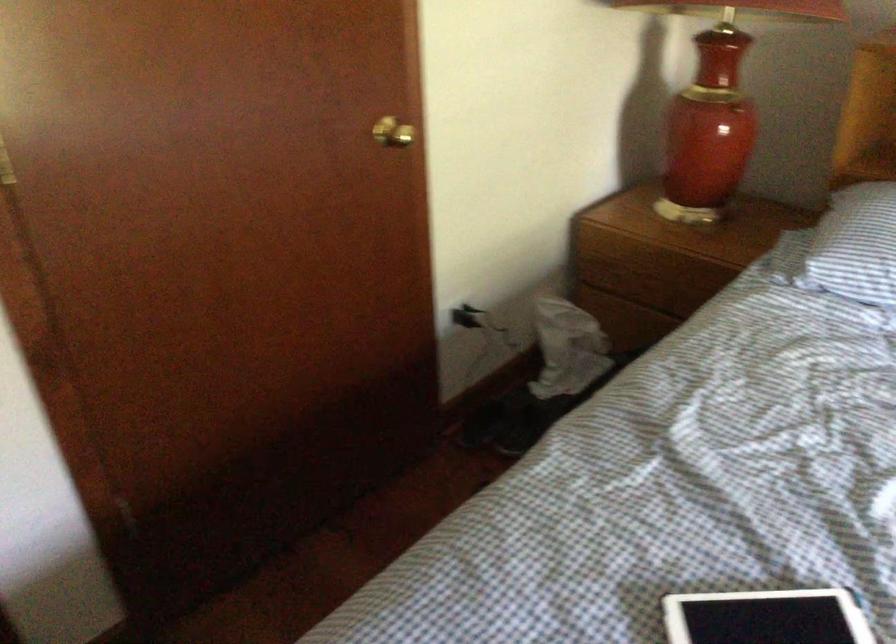
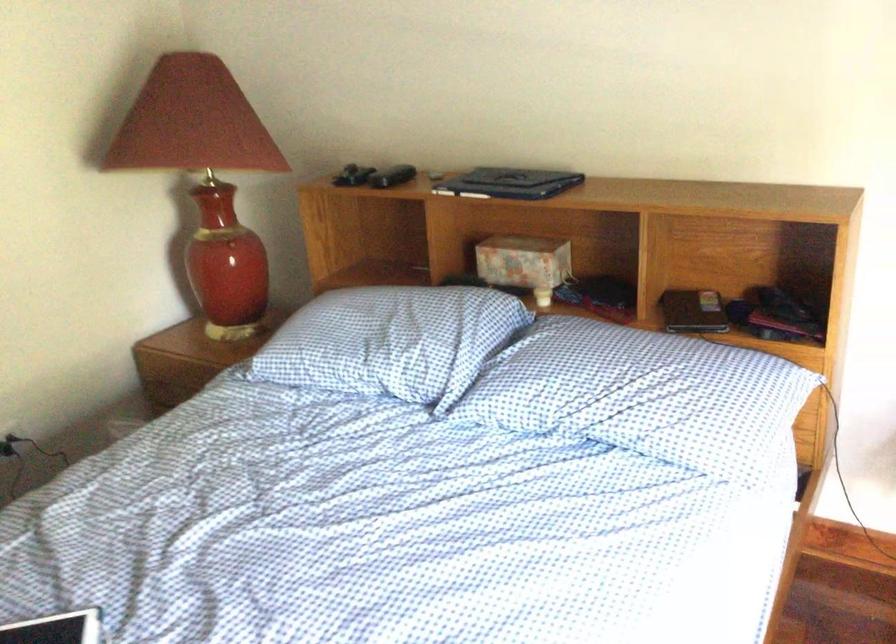
In a continuous first-person perspective shot, in which direction is the camera moving?

The movement direction of the cameraman is right, backward.